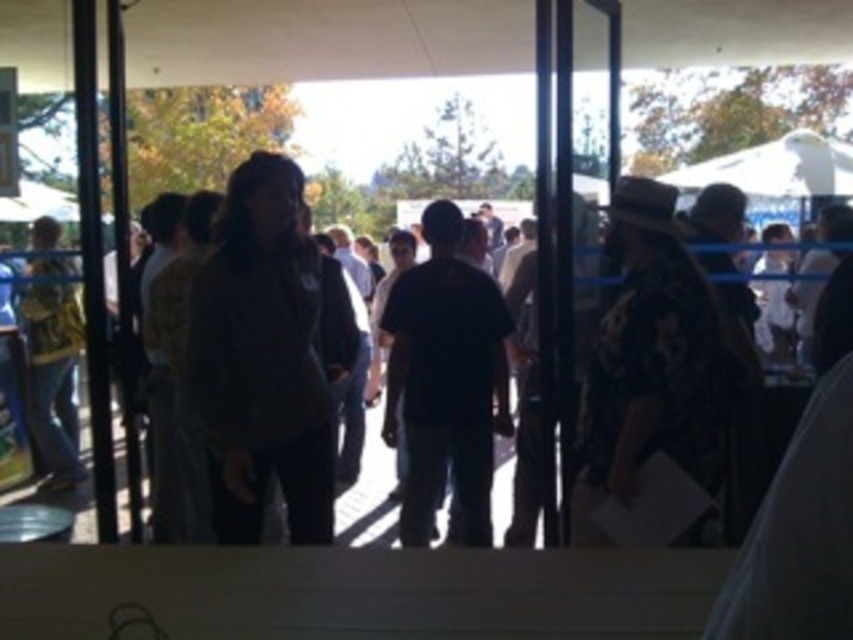
You are standing inside a building and want to exit through the transparent glass door at center. However, you are wearing the dark gray jacket at center. Can you pass through the door without removing the jacket?

The transparent glass door at center has a lesser width compared to dark gray jacket at center, so the jacket might be too wide to fit through the door. You may need to adjust your jacket or find a wider door.